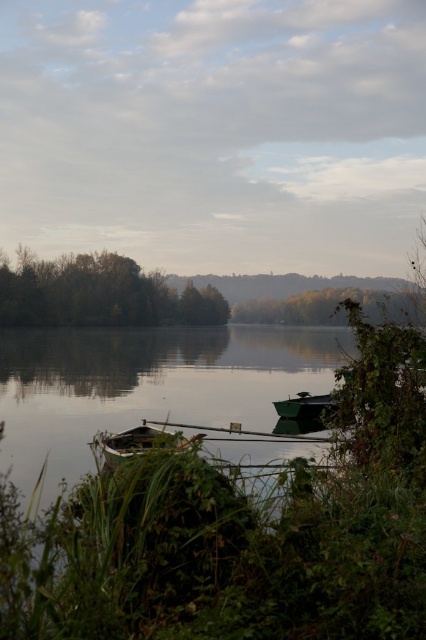
You are standing on the lakeshore and want to walk to the wooden boat at center. There are green leafy trees at left blocking your path. Can you easily walk around them to reach the boat?

The green leafy trees at left are closer to you than the wooden boat at center, so you can walk around them to reach the boat.

You are standing at the center of the image. Which direction should you look to see the green leafy trees at left?

The green leafy trees at left are located at point (98, 292), so you should look to your left to see them.

Based on the coordinates provided, which object in the scene is located at point (x=98, y=292)?

The green leafy trees at left is located at point (x=98, y=292).